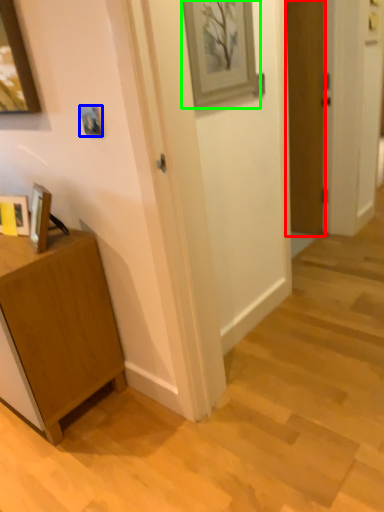
Question: Based on their relative distances, which object is farther from door (highlighted by a red box)? Choose from picture frame (highlighted by a blue box) and picture frame (highlighted by a green box).

Choices:
 (A) picture frame
 (B) picture frame

Answer: (A)